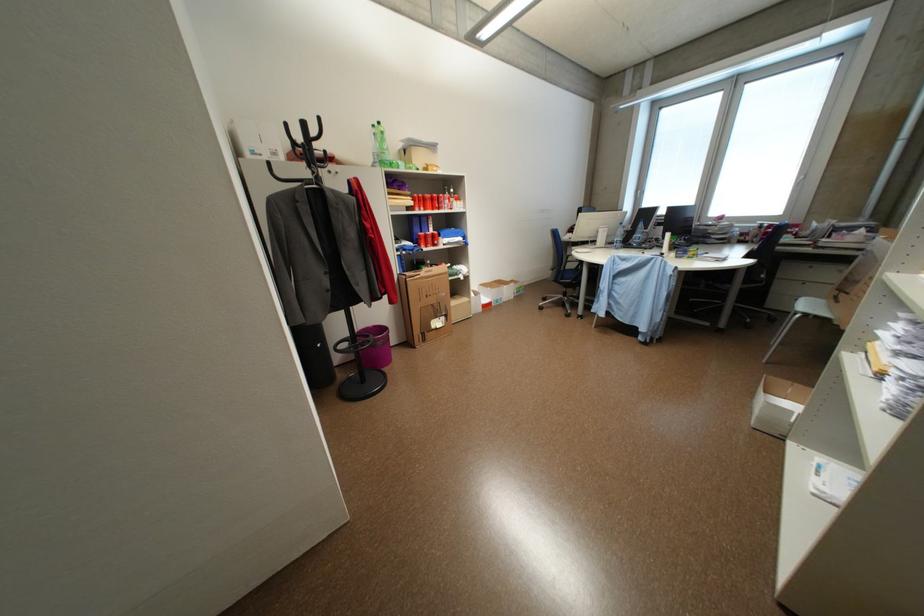
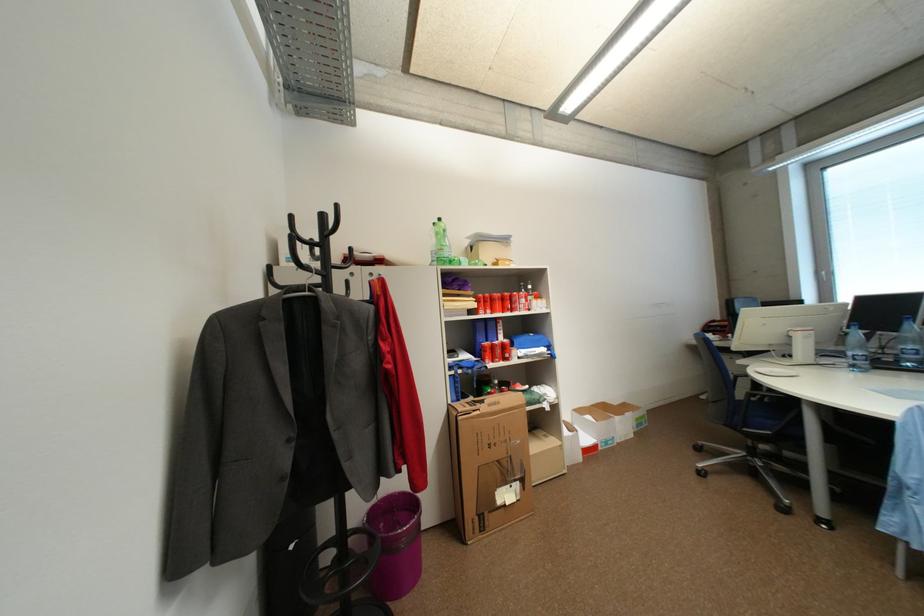
The point at [382,127] is marked in the first image. Where is the corresponding point in the second image?

(443, 225)